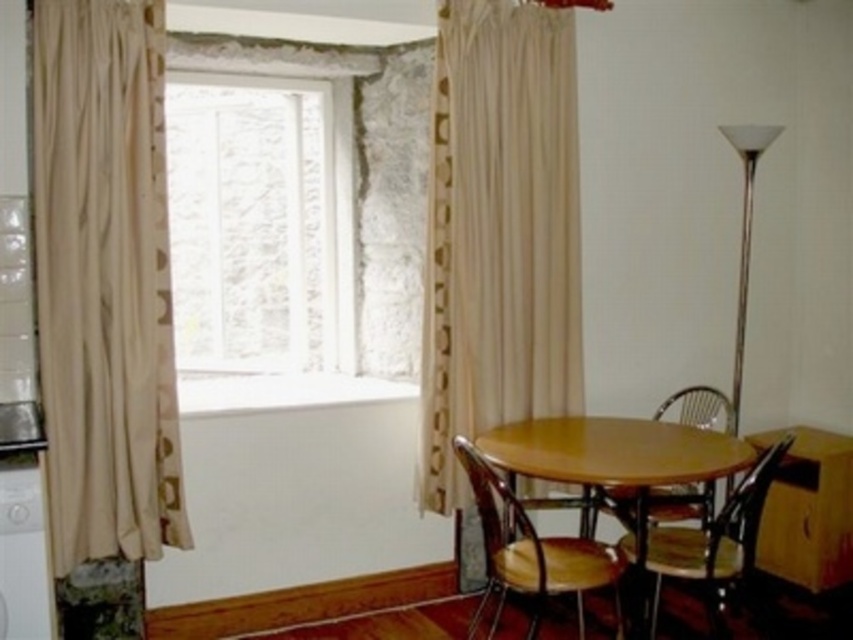
What do you see at coordinates (532, 550) in the screenshot? The width and height of the screenshot is (853, 640). I see `wooden at center` at bounding box center [532, 550].

Is wooden at center shorter than white glossy washing machine at left?

No, wooden at center is not shorter than white glossy washing machine at left.

Which is behind, point (529, 541) or point (20, 600)?

Positioned behind is point (529, 541).

At what (x,y) coordinates should I click in order to perform the action: click on wooden at center. Please return your answer as a coordinate pair (x, y). Looking at the image, I should click on (532, 550).

Which is more to the right, beige fabric curtain at center or wooden polished chair at lower right?

Positioned to the right is wooden polished chair at lower right.

Is beige fabric curtain at center closer to camera compared to wooden polished chair at lower right?

No, beige fabric curtain at center is behind wooden polished chair at lower right.

Who is more forward, (x=527, y=264) or (x=656, y=602)?

Point (x=656, y=602)

You are a GUI agent. You are given a task and a screenshot of the screen. Output one action in this format:
    pyautogui.click(x=<x>, y=<y>)
    Task: Click on the beige fabric curtain at center
    
    Given the screenshot: What is the action you would take?
    pyautogui.click(x=498, y=232)

Which is behind, point (654, 561) or point (22, 483)?

The point (654, 561) is more distant.

Who is more distant from viewer, (688, 577) or (36, 538)?

The point (688, 577) is behind.

Where is `wooden polished chair at lower right`? This screenshot has width=853, height=640. wooden polished chair at lower right is located at coordinates (714, 540).